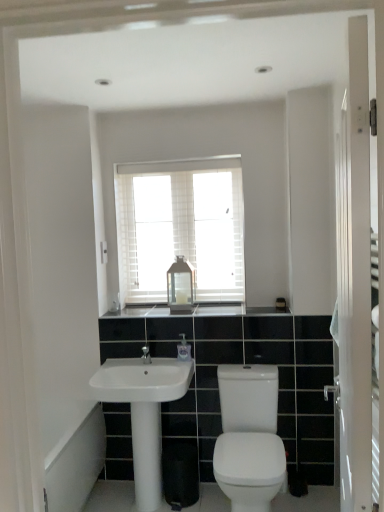
Question: Is white glossy bath at lower left not inside white glossy screen door at right?

Choices:
 (A) no
 (B) yes

Answer: (B)

Question: Is white glossy bath at lower left thinner than white glossy screen door at right?

Choices:
 (A) no
 (B) yes

Answer: (A)

Question: Does white glossy bath at lower left have a lesser height compared to white glossy screen door at right?

Choices:
 (A) no
 (B) yes

Answer: (B)

Question: Considering the relative positions of white glossy bath at lower left and white glossy screen door at right in the image provided, is white glossy bath at lower left to the right of white glossy screen door at right from the viewer's perspective?

Choices:
 (A) no
 (B) yes

Answer: (A)

Question: From the image's perspective, is white glossy bath at lower left on top of white glossy screen door at right?

Choices:
 (A) no
 (B) yes

Answer: (A)

Question: From the image's perspective, is white glossy bath at lower left below white glossy screen door at right?

Choices:
 (A) no
 (B) yes

Answer: (B)

Question: From a real-world perspective, is black granite countertop at center positioned under white glossy sink at center based on gravity?

Choices:
 (A) no
 (B) yes

Answer: (A)

Question: From a real-world perspective, is black granite countertop at center located higher than white glossy sink at center?

Choices:
 (A) yes
 (B) no

Answer: (A)

Question: Can you confirm if black granite countertop at center is shorter than white glossy sink at center?

Choices:
 (A) yes
 (B) no

Answer: (A)

Question: Is black granite countertop at center aimed at white glossy sink at center?

Choices:
 (A) yes
 (B) no

Answer: (B)

Question: Does black granite countertop at center have a larger size compared to white glossy sink at center?

Choices:
 (A) yes
 (B) no

Answer: (B)

Question: Is black granite countertop at center behind white glossy sink at center?

Choices:
 (A) yes
 (B) no

Answer: (A)

Question: Would you say black granite countertop at center is a long distance from white glossy screen door at right?

Choices:
 (A) no
 (B) yes

Answer: (B)